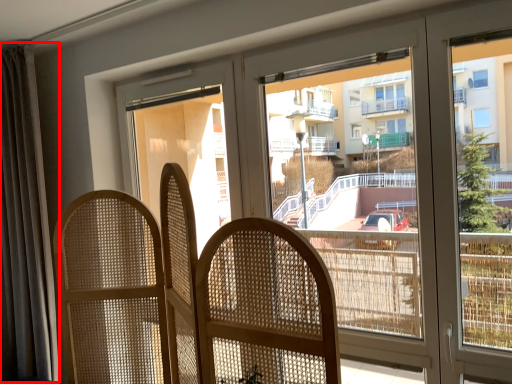
Question: From the image, what is the correct spatial relationship of curtain (annotated by the red box) in relation to rocking chair?

Choices:
 (A) left
 (B) right

Answer: (A)